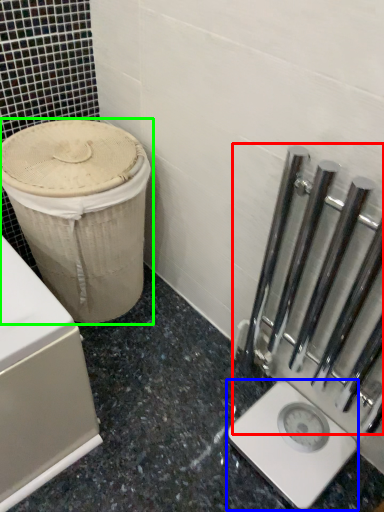
Question: Estimate the real-world distances between objects in this image. Which object is farther from rail (highlighted by a red box), scale (highlighted by a blue box) or waste container (highlighted by a green box)?

Choices:
 (A) scale
 (B) waste container

Answer: (B)